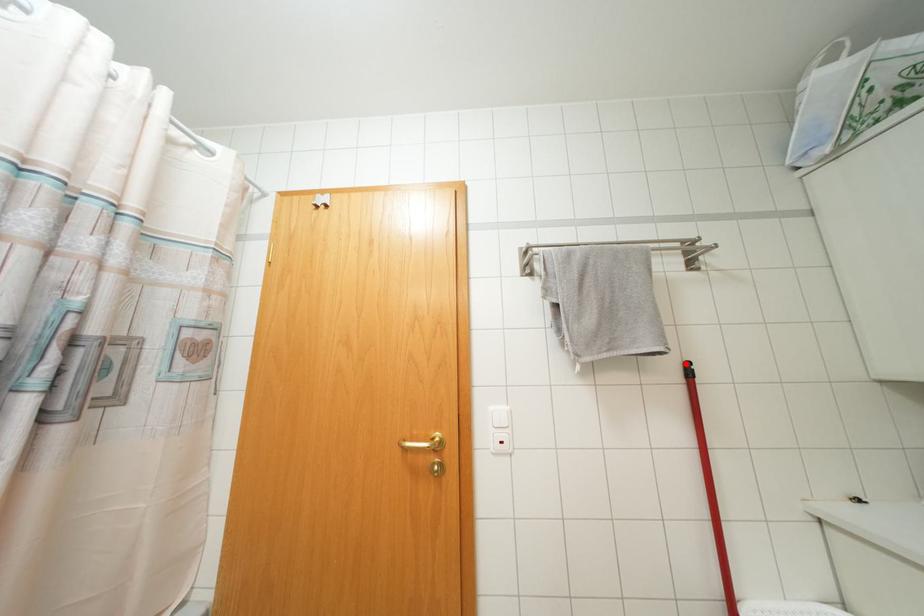
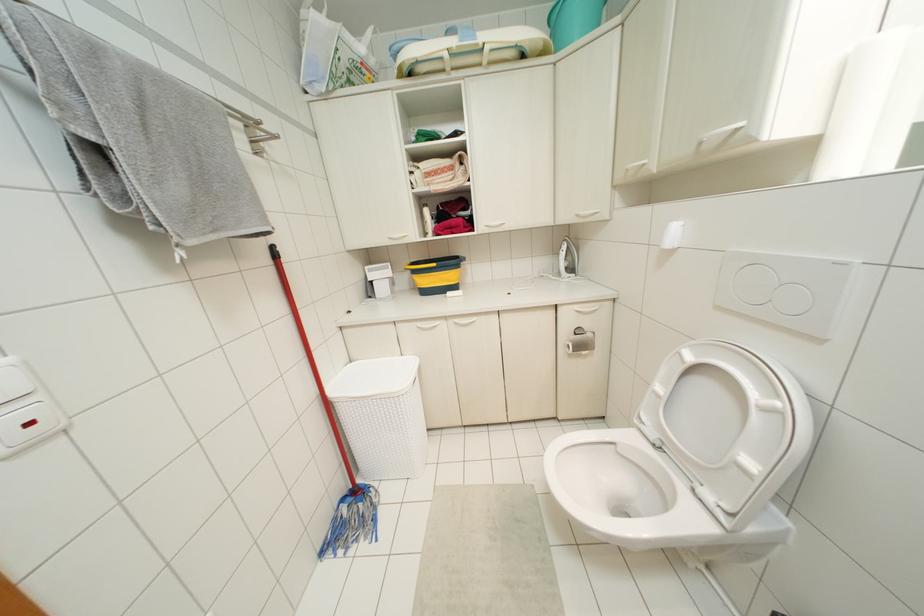
The point at the highlighted location is marked in the first image. Where is the corresponding point in the second image?

(273, 246)